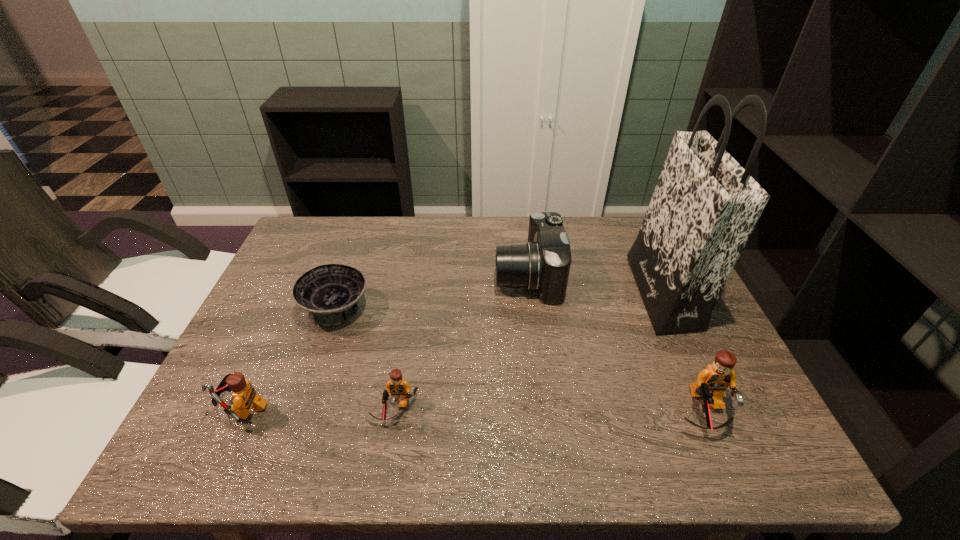
You are a GUI agent. You are given a task and a screenshot of the screen. Output one action in this format:
    pyautogui.click(x=<x>, y=<y>)
    Task: Click on the free space located 0.100m on the lens of the camera
    
    Given the screenshot: What is the action you would take?
    pyautogui.click(x=461, y=276)

Image resolution: width=960 pixels, height=540 pixels. Identify the location of vacant space situated on the right of the bowl. (487, 309).

Where is `vacant space situated on the front of the shopping bag with the design`? vacant space situated on the front of the shopping bag with the design is located at coordinates (501, 292).

Where is `vacant space located on the front of the shopping bag with the design`? The height and width of the screenshot is (540, 960). vacant space located on the front of the shopping bag with the design is located at coordinates (513, 292).

Where is `vacant space located 0.180m on the front of the shopping bag with the design`? The width and height of the screenshot is (960, 540). vacant space located 0.180m on the front of the shopping bag with the design is located at coordinates (574, 292).

Locate an element on the screen. This screenshot has width=960, height=540. camera positioned at the far edge is located at coordinates (543, 265).

Find the location of a particular element. shopping bag that is at the far edge is located at coordinates (705, 205).

The width and height of the screenshot is (960, 540). What are the coordinates of `Lego that is at the left edge` in the screenshot? It's located at (244, 396).

Image resolution: width=960 pixels, height=540 pixels. I want to click on bowl situated at the left edge, so click(330, 293).

You are a GUI agent. You are given a task and a screenshot of the screen. Output one action in this format:
    pyautogui.click(x=<x>, y=<y>)
    Task: Click on the Lego that is positioned at the right edge
    
    Given the screenshot: What is the action you would take?
    pyautogui.click(x=712, y=382)